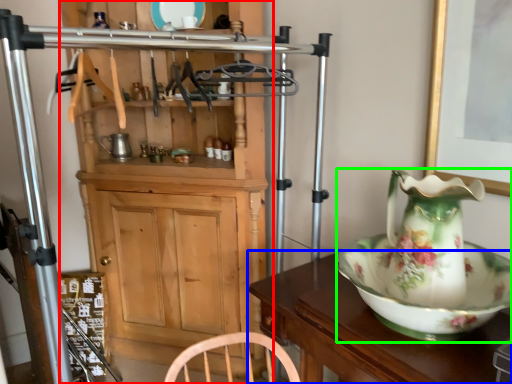
Question: Based on their relative distances, which object is farther from cabinetry (highlighted by a red box)? Choose from table (highlighted by a blue box) and jug (highlighted by a green box).

Choices:
 (A) table
 (B) jug

Answer: (B)